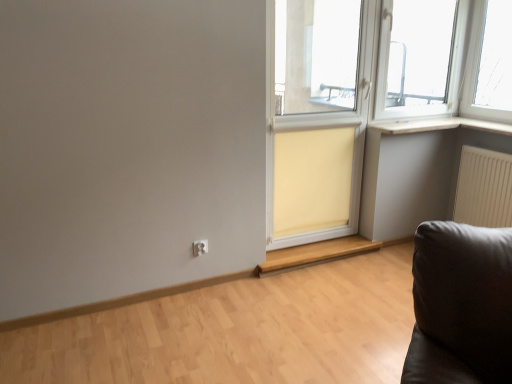
Question: Is beige fabric curtain at center smaller than white plastic electric outlet at lower center?

Choices:
 (A) no
 (B) yes

Answer: (A)

Question: Is there a large distance between beige fabric curtain at center and white plastic electric outlet at lower center?

Choices:
 (A) yes
 (B) no

Answer: (B)

Question: Is beige fabric curtain at center facing towards white plastic electric outlet at lower center?

Choices:
 (A) no
 (B) yes

Answer: (A)

Question: Is the position of beige fabric curtain at center less distant than that of white plastic electric outlet at lower center?

Choices:
 (A) no
 (B) yes

Answer: (A)

Question: Does beige fabric curtain at center have a lesser height compared to white plastic electric outlet at lower center?

Choices:
 (A) yes
 (B) no

Answer: (B)

Question: Would you say beige fabric screen door at center is to the left or to the right of beige fabric curtain at center in the picture?

Choices:
 (A) left
 (B) right

Answer: (B)

Question: Looking at their shapes, would you say beige fabric screen door at center is wider or thinner than beige fabric curtain at center?

Choices:
 (A) wide
 (B) thin

Answer: (A)

Question: Relative to beige fabric curtain at center, is beige fabric screen door at center in front or behind?

Choices:
 (A) front
 (B) behind

Answer: (A)

Question: From the image's perspective, is beige fabric screen door at center positioned above or below beige fabric curtain at center?

Choices:
 (A) above
 (B) below

Answer: (A)

Question: Is white plastic electric outlet at lower center spatially inside white matte wood at upper right, or outside of it?

Choices:
 (A) outside
 (B) inside

Answer: (A)

Question: In terms of width, does white plastic electric outlet at lower center look wider or thinner when compared to white matte wood at upper right?

Choices:
 (A) wide
 (B) thin

Answer: (B)

Question: Relative to white matte wood at upper right, is white plastic electric outlet at lower center in front or behind?

Choices:
 (A) behind
 (B) front

Answer: (B)

Question: Considering the relative positions of white plastic electric outlet at lower center and white matte wood at upper right in the image provided, is white plastic electric outlet at lower center to the left or to the right of white matte wood at upper right?

Choices:
 (A) left
 (B) right

Answer: (A)

Question: In the image, is beige fabric curtain at center positioned in front of or behind white plastic electric outlet at lower center?

Choices:
 (A) behind
 (B) front

Answer: (A)

Question: Is point (326, 193) positioned closer to the camera than point (194, 241)?

Choices:
 (A) farther
 (B) closer

Answer: (A)